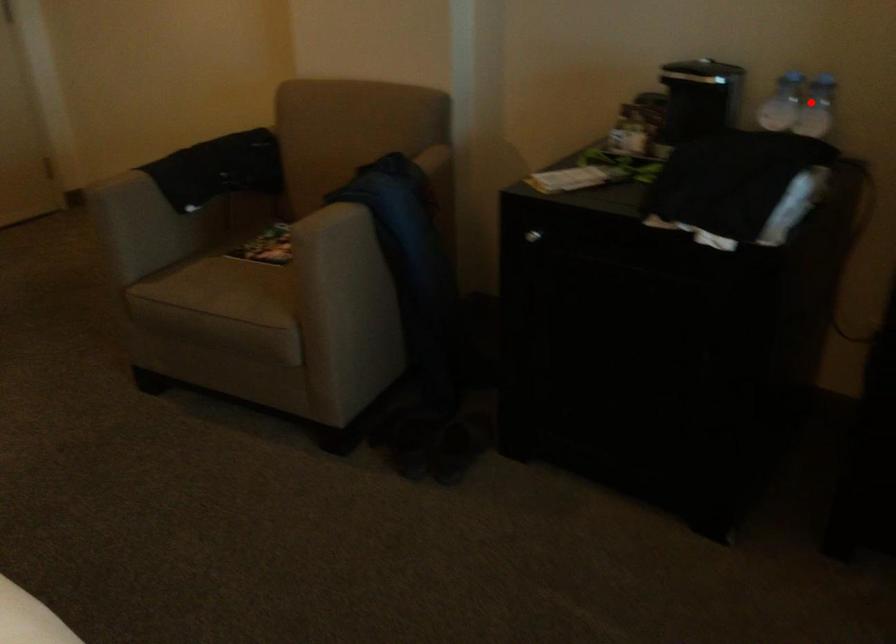
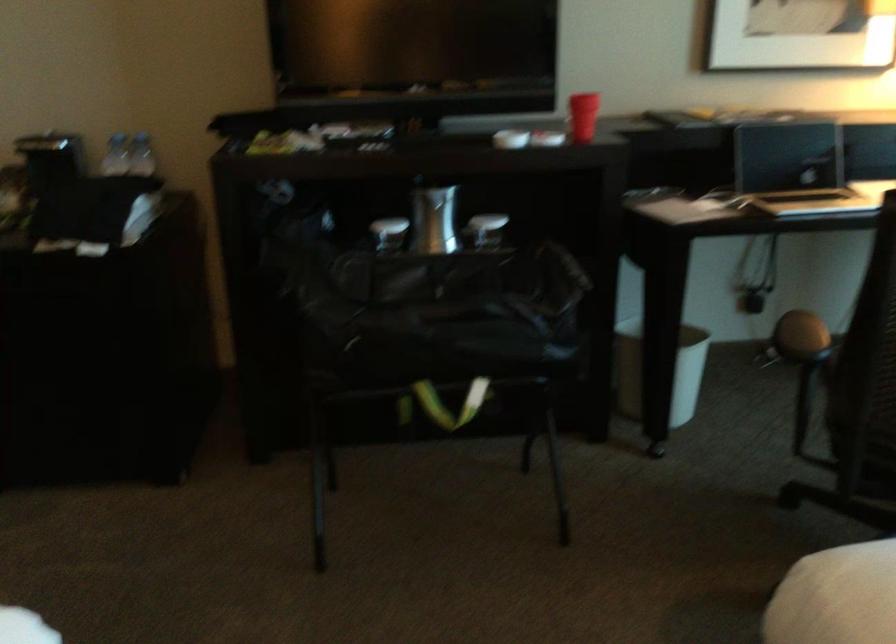
Question: I am providing you with two images of the same scene from different viewpoints. Image1 has a red point marked. In image2, the corresponding 3D location appears at what relative position? Reply with the corresponding letter.

Choices:
 (A) Closer
 (B) Farther

Answer: (B)